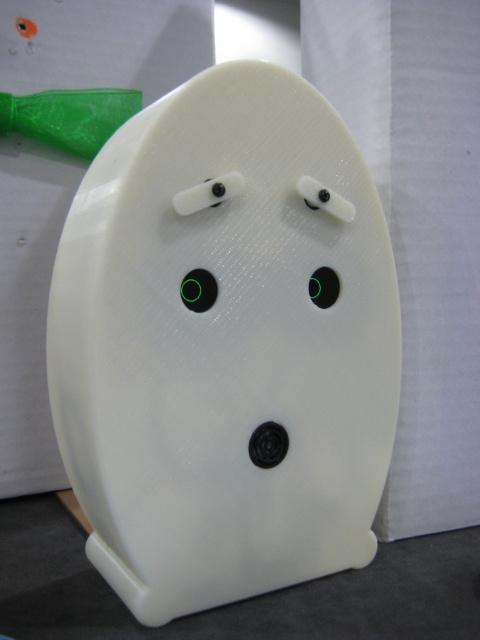
Who is more distant from viewer, (182, 285) or (314, 273)?

The point (314, 273) is behind.

Does point (180, 285) come closer to viewer compared to point (326, 268)?

Yes.

I want to click on matte black circle at center, so click(199, 289).

Identify the location of matte black circle at center. This screenshot has height=640, width=480. (199, 289).

Can you confirm if white matte urinal at center is shorter than black matte circle at center?

In fact, white matte urinal at center may be taller than black matte circle at center.

Does white matte urinal at center have a greater height compared to black matte circle at center?

Correct, white matte urinal at center is much taller as black matte circle at center.

The height and width of the screenshot is (640, 480). What do you see at coordinates (225, 346) in the screenshot? I see `white matte urinal at center` at bounding box center [225, 346].

Image resolution: width=480 pixels, height=640 pixels. What are the coordinates of `white matte urinal at center` in the screenshot? It's located at (225, 346).

Who is taller, white matte urinal at center or matte black circle at center?

white matte urinal at center

From the picture: Is white matte urinal at center to the left of matte black circle at center from the viewer's perspective?

Incorrect, white matte urinal at center is not on the left side of matte black circle at center.

Where is `white matte urinal at center`? The image size is (480, 640). white matte urinal at center is located at coordinates (225, 346).